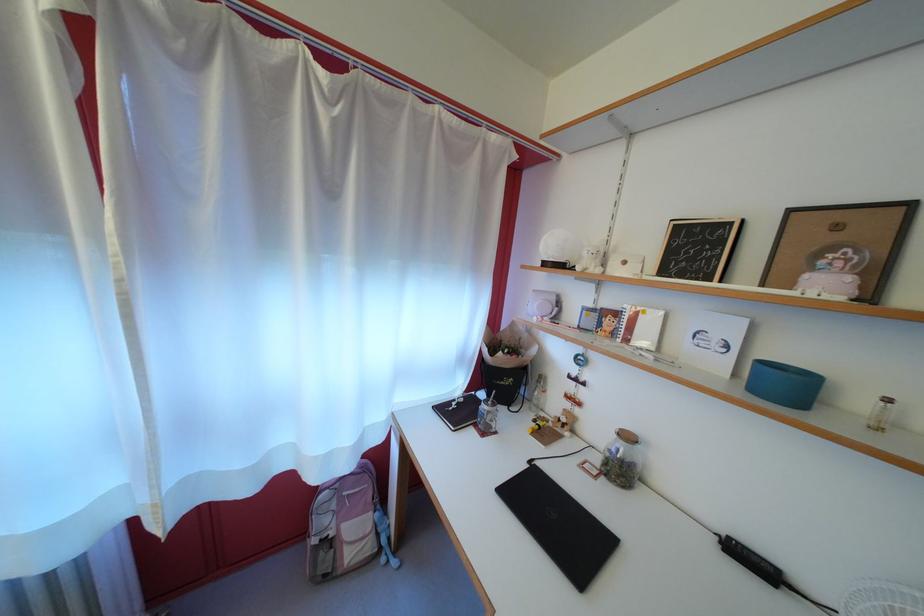
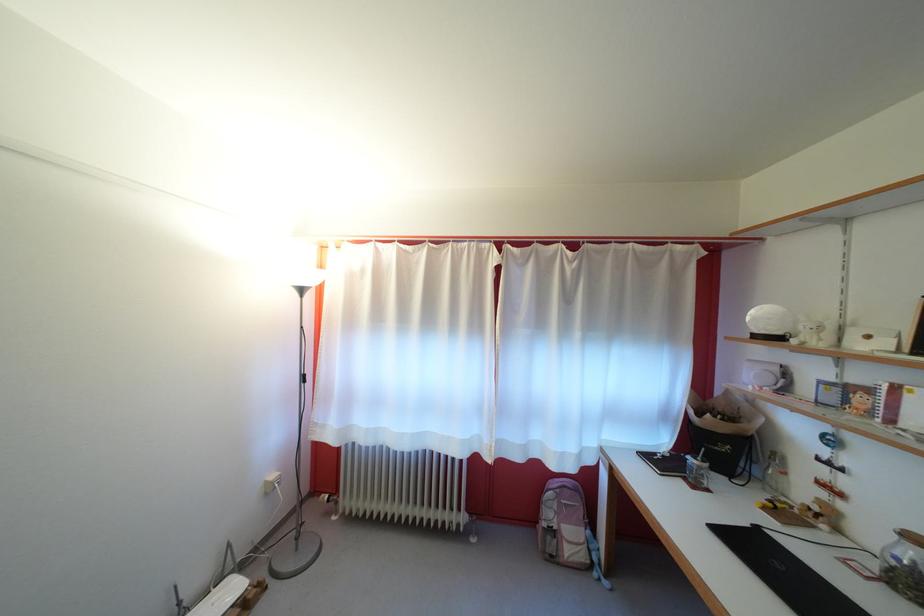
Locate, in the second image, the point that corresponds to (593,259) in the first image.

(809, 334)